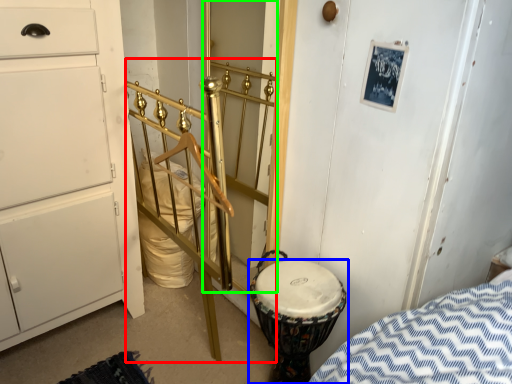
Question: Based on their relative distances, which object is farther from rail (highlighted by a red box)? Choose from drum (highlighted by a blue box) and door (highlighted by a green box).

Choices:
 (A) drum
 (B) door

Answer: (B)